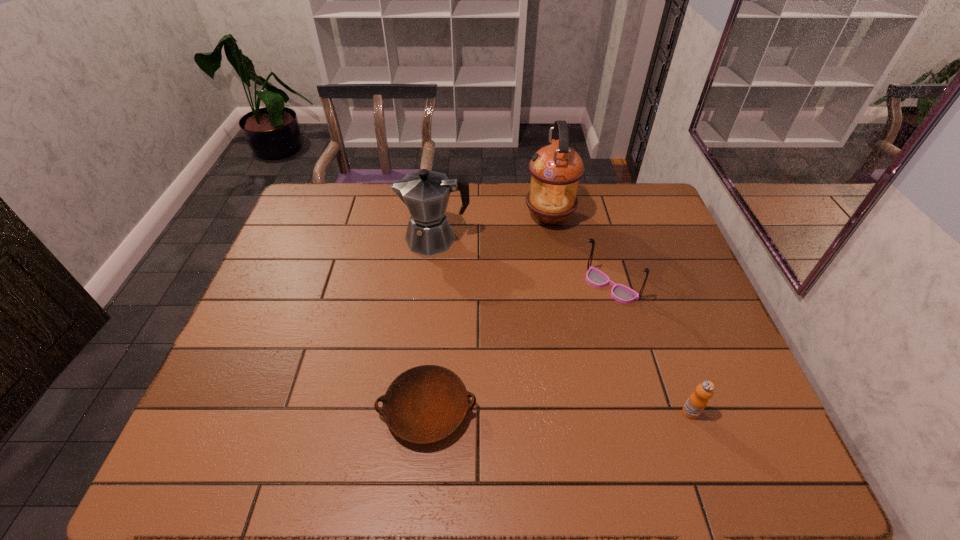
Where is `free space located at the spout of the fourth shortest object`? free space located at the spout of the fourth shortest object is located at coordinates (351, 239).

I want to click on blank space located on the back of the third nearest object, so click(588, 206).

Where is `vacant space located 0.100m on the front label of the rightmost object`? The width and height of the screenshot is (960, 540). vacant space located 0.100m on the front label of the rightmost object is located at coordinates (709, 465).

Find the location of a particular element. Image resolution: width=960 pixels, height=540 pixels. vacant space located 0.070m on the left of the shortest object is located at coordinates (347, 410).

At what (x,y) coordinates should I click in order to perform the action: click on oil lamp that is positioned at the far edge. Please return your answer as a coordinate pair (x, y). Looking at the image, I should click on tap(556, 169).

Find the location of a particular element. This screenshot has height=540, width=960. coffeepot situated at the far edge is located at coordinates (426, 193).

Locate an element on the screen. object that is at the near edge is located at coordinates (426, 404).

Where is `object at the right edge`? object at the right edge is located at coordinates (697, 401).

In the image, there is a desktop. At what (x,y) coordinates should I click in order to perform the action: click on free space at the far edge. Please return your answer as a coordinate pair (x, y). Image resolution: width=960 pixels, height=540 pixels. Looking at the image, I should click on (363, 185).

You are a GUI agent. You are given a task and a screenshot of the screen. Output one action in this format:
    pyautogui.click(x=<x>, y=<y>)
    Task: Click on the vacant space at the near edge
    The width and height of the screenshot is (960, 540).
    Given the screenshot: What is the action you would take?
    pyautogui.click(x=464, y=435)